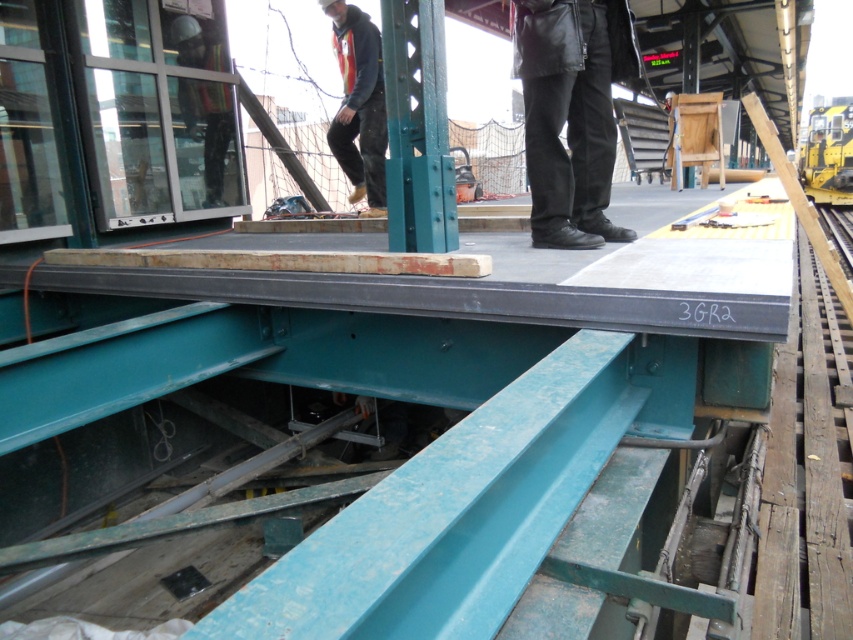
Question: Which of the following is the closest to the observer?

Choices:
 (A) (338, 150)
 (B) (543, 156)

Answer: (B)

Question: Which point is farther to the camera?

Choices:
 (A) (572, 202)
 (B) (363, 65)

Answer: (B)

Question: Considering the relative positions of black leather pants at center and reflective safety vest at upper center in the image provided, where is black leather pants at center located with respect to reflective safety vest at upper center?

Choices:
 (A) below
 (B) above

Answer: (A)

Question: Does black leather pants at center have a lesser width compared to reflective safety vest at upper center?

Choices:
 (A) yes
 (B) no

Answer: (B)

Question: Which object is farther from the camera taking this photo?

Choices:
 (A) reflective safety vest at upper center
 (B) black leather pants at center

Answer: (A)

Question: Does black leather pants at center appear under reflective safety vest at upper center?

Choices:
 (A) yes
 (B) no

Answer: (A)